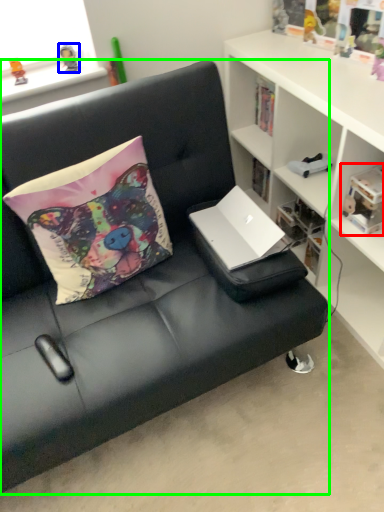
Question: Which object is positioned farthest from book (highlighted by a red box)? Select from toy (highlighted by a blue box) and studio couch (highlighted by a green box).

Choices:
 (A) toy
 (B) studio couch

Answer: (A)